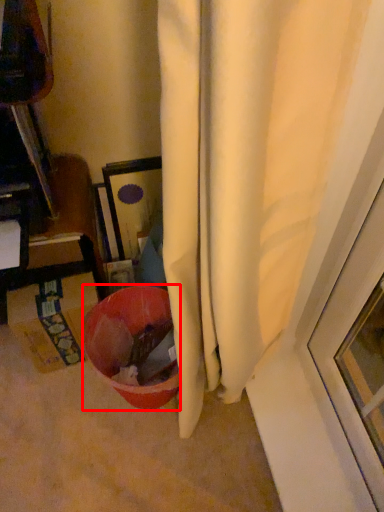
Question: Considering the relative positions of bowl (annotated by the red box) and cardboard box in the image provided, where is bowl (annotated by the red box) located with respect to the staircase?

Choices:
 (A) right
 (B) left

Answer: (A)